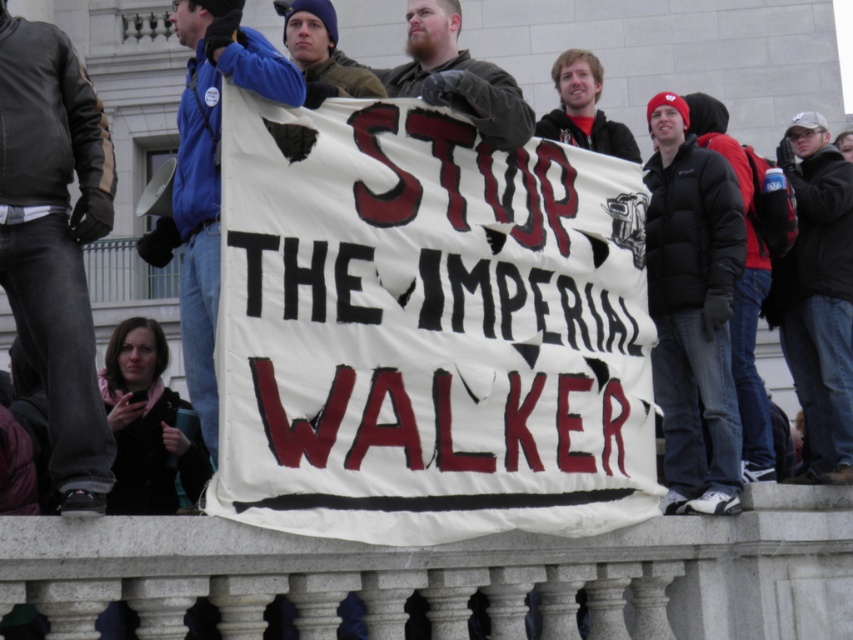
Question: Which point is closer to the camera?

Choices:
 (A) (601, 129)
 (B) (375, 77)
 (C) (814, 387)
 (D) (107, 467)

Answer: (D)

Question: Which object is closer to the camera taking this photo?

Choices:
 (A) matte black jacket at upper center
 (B) black jacket at center

Answer: (A)

Question: Can you confirm if blue fleece jacket at center is thinner than black jacket at center?

Choices:
 (A) yes
 (B) no

Answer: (B)

Question: Is blue fleece jacket at center smaller than bearded man at center?

Choices:
 (A) yes
 (B) no

Answer: (B)

Question: Which object is farther from the camera taking this photo?

Choices:
 (A) blue fleece jacket at center
 (B) black puffy jacket at center

Answer: (B)

Question: Does black puffy jacket at center appear under black jacket at center?

Choices:
 (A) yes
 (B) no

Answer: (A)